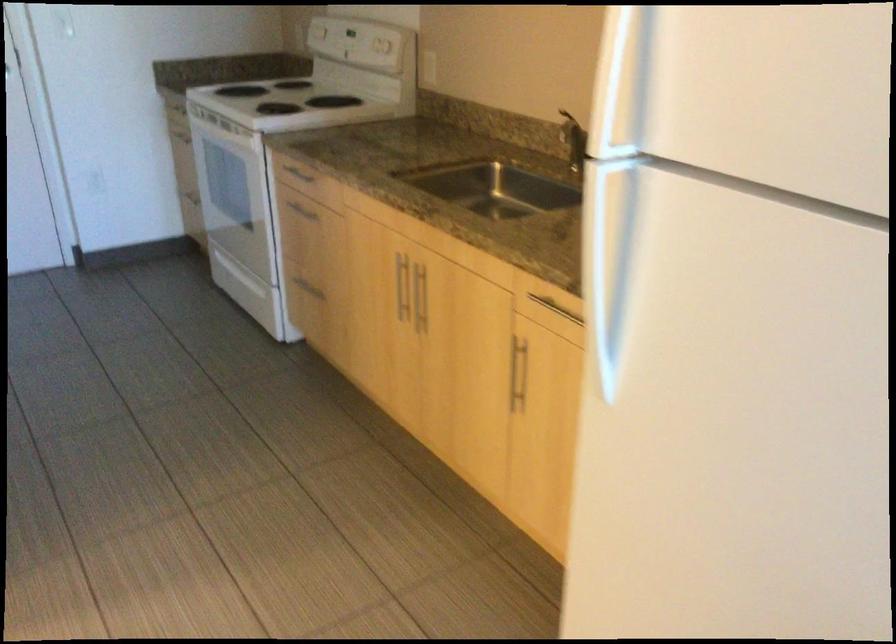
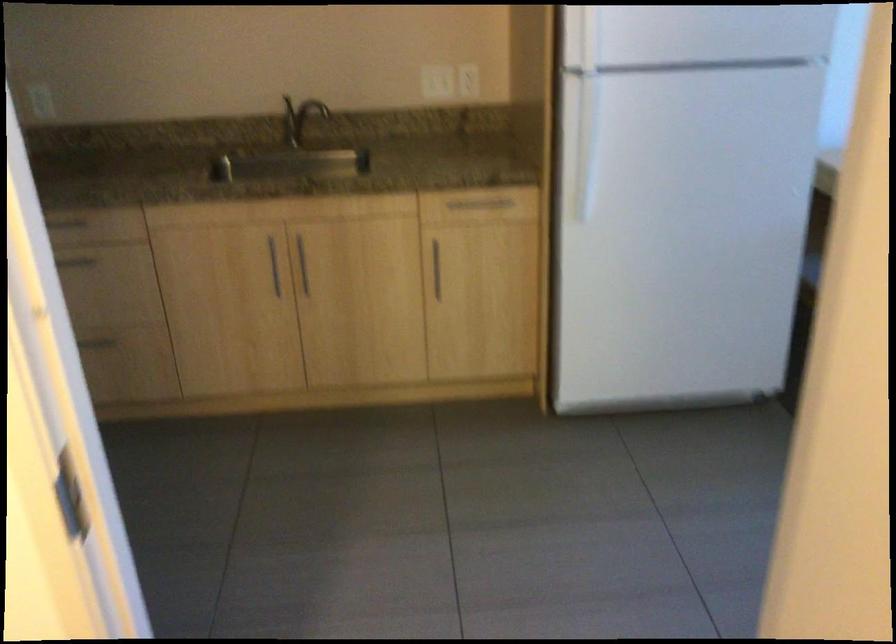
Find the pixel in the second image that matches (626,96) in the first image.

(581, 39)